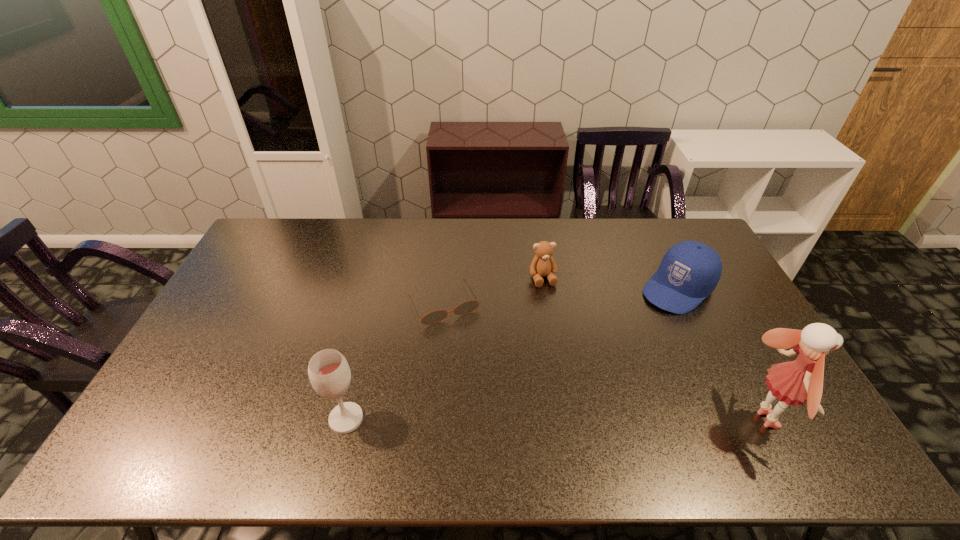
I want to click on free space on the desktop that is between the wineglass and the doll and is positioned on the face of the fourth object from right to left, so [x=502, y=419].

You are a GUI agent. You are given a task and a screenshot of the screen. Output one action in this format:
    pyautogui.click(x=<x>, y=<y>)
    Task: Click on the vacant space on the desktop that is between the wineglass and the tallest object and is positioned on the front-facing side of the cap
    This screenshot has width=960, height=540.
    Given the screenshot: What is the action you would take?
    pyautogui.click(x=524, y=419)

Locate an element on the screen. The width and height of the screenshot is (960, 540). vacant spot on the desktop that is between the leftmost object and the tallest object and is positioned on the face of the third object from right to left is located at coordinates (591, 419).